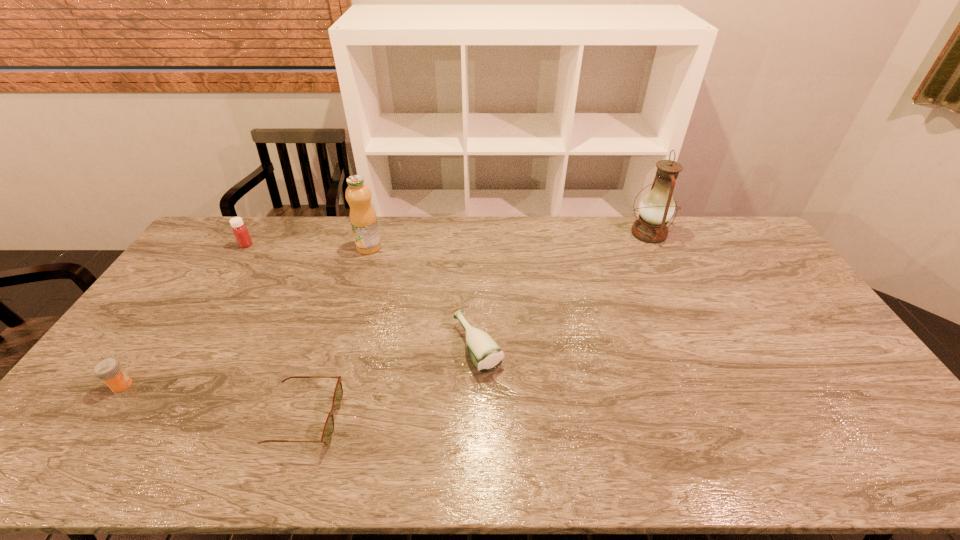
Identify the location of vacant position in the image that satisfies the following two spatial constraints: 1. on the front label of the fruit juice; 2. on the label side of the left medicine. (327, 384).

Image resolution: width=960 pixels, height=540 pixels. Identify the location of free space that satisfies the following two spatial constraints: 1. on the front side of the taller medicine; 2. on the right side of the bottle. (181, 346).